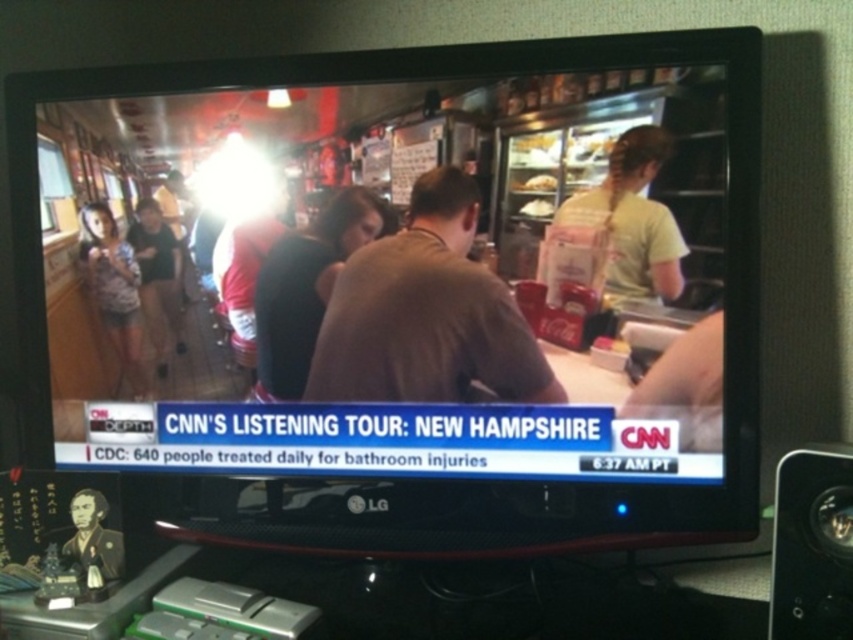
Question: Does matte black tv at center have a smaller size compared to matte pink shirt at left?

Choices:
 (A) no
 (B) yes

Answer: (A)

Question: Among these points, which one is nearest to the camera?

Choices:
 (A) (230, 252)
 (B) (514, 362)
 (C) (177, 353)
 (D) (341, 259)

Answer: (B)

Question: In this image, where is white cotton shirt at upper right located relative to matte black shirt at center?

Choices:
 (A) above
 (B) below

Answer: (A)

Question: Which object appears closest to the camera in this image?

Choices:
 (A) dark brown shirt at center
 (B) matte pink shirt at left

Answer: (A)

Question: Can you confirm if white cotton shirt at upper right is positioned to the left of black matte portrait at lower left?

Choices:
 (A) no
 (B) yes

Answer: (A)

Question: Which point is farther from the camera taking this photo?

Choices:
 (A) (80, 506)
 (B) (170, 236)

Answer: (B)